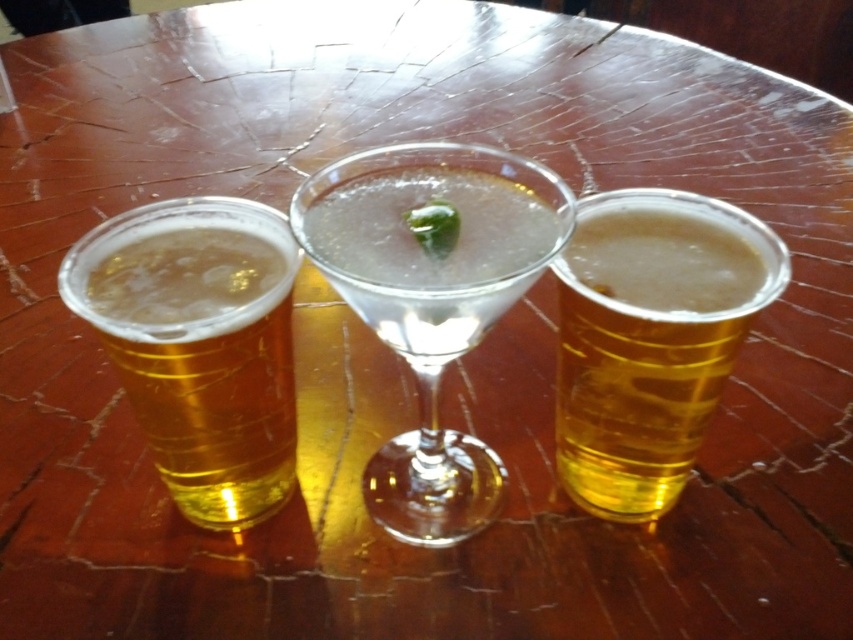
In the scene shown: Does translucent plastic cup at left come behind translucent plastic cup at right?

No, translucent plastic cup at left is closer to the viewer.

Image resolution: width=853 pixels, height=640 pixels. Describe the element at coordinates (200, 344) in the screenshot. I see `translucent plastic cup at left` at that location.

Where is `translucent plastic cup at left`? translucent plastic cup at left is located at coordinates coord(200,344).

Between clear glass martini at center and translucent plastic cup at left, which one is positioned lower?

translucent plastic cup at left

Measure the distance between clear glass martini at center and translucent plastic cup at left.

A distance of 1.64 inches exists between clear glass martini at center and translucent plastic cup at left.

Describe the element at coordinates (432, 298) in the screenshot. Image resolution: width=853 pixels, height=640 pixels. I see `clear glass martini at center` at that location.

Image resolution: width=853 pixels, height=640 pixels. In order to click on clear glass martini at center in this screenshot , I will do `click(432, 298)`.

The height and width of the screenshot is (640, 853). What do you see at coordinates (432, 298) in the screenshot?
I see `clear glass martini at center` at bounding box center [432, 298].

How much distance is there between clear glass martini at center and translucent plastic cup at right?

They are 3.80 centimeters apart.

Between point (370, 314) and point (592, 376), which one is positioned behind?

The point (592, 376) is more distant.

I want to click on clear glass martini at center, so click(432, 298).